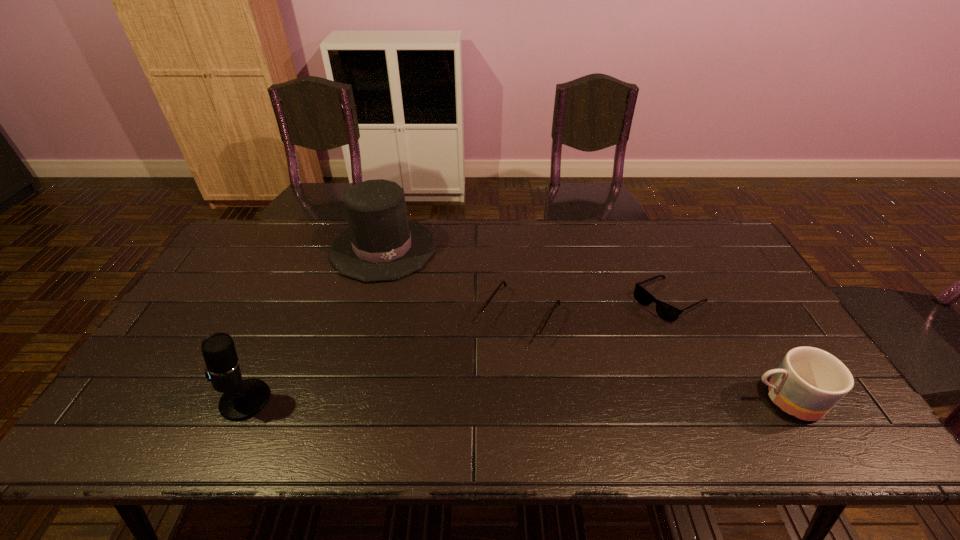
You are a GUI agent. You are given a task and a screenshot of the screen. Output one action in this format:
    pyautogui.click(x=<x>, y=<y>)
    Task: Click on the free space located at the hinge ends of the third object from right to left
    This screenshot has height=540, width=960.
    Given the screenshot: What is the action you would take?
    pyautogui.click(x=485, y=374)

Find the location of `blank space located 0.150m at the hinge ends of the third object from right to left`. blank space located 0.150m at the hinge ends of the third object from right to left is located at coordinates (478, 386).

Locate an element on the screen. This screenshot has width=960, height=540. vacant region located on the front-facing side of the sunglasses is located at coordinates (623, 335).

The width and height of the screenshot is (960, 540). In order to click on free point located on the front-facing side of the sunglasses in this screenshot , I will do `click(605, 349)`.

At what (x,y) coordinates should I click in order to perform the action: click on free space located 0.250m on the front-facing side of the sunglasses. Please return your answer as a coordinate pair (x, y). Looking at the image, I should click on (590, 361).

Locate an element on the screen. This screenshot has height=540, width=960. vacant area located on the front of the dress hat with the decoration is located at coordinates (410, 321).

The height and width of the screenshot is (540, 960). In order to click on free space located on the front of the dress hat with the decoration in this screenshot , I will do [x=406, y=309].

The width and height of the screenshot is (960, 540). What are the coordinates of `vacant region located on the front of the dress hat with the decoration` in the screenshot? It's located at (414, 331).

Find the location of a particular element. Image resolution: width=960 pixels, height=540 pixels. object positioned at the far edge is located at coordinates (381, 244).

I want to click on microphone at the near edge, so click(242, 399).